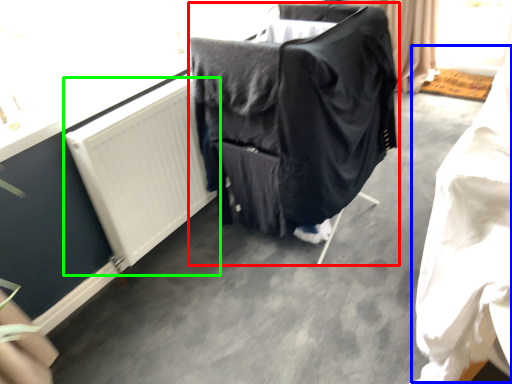
Question: Based on their relative distances, which object is nearer to furniture (highlighted by a red box)? Choose from clothing (highlighted by a blue box) and radiator (highlighted by a green box).

Choices:
 (A) clothing
 (B) radiator

Answer: (B)